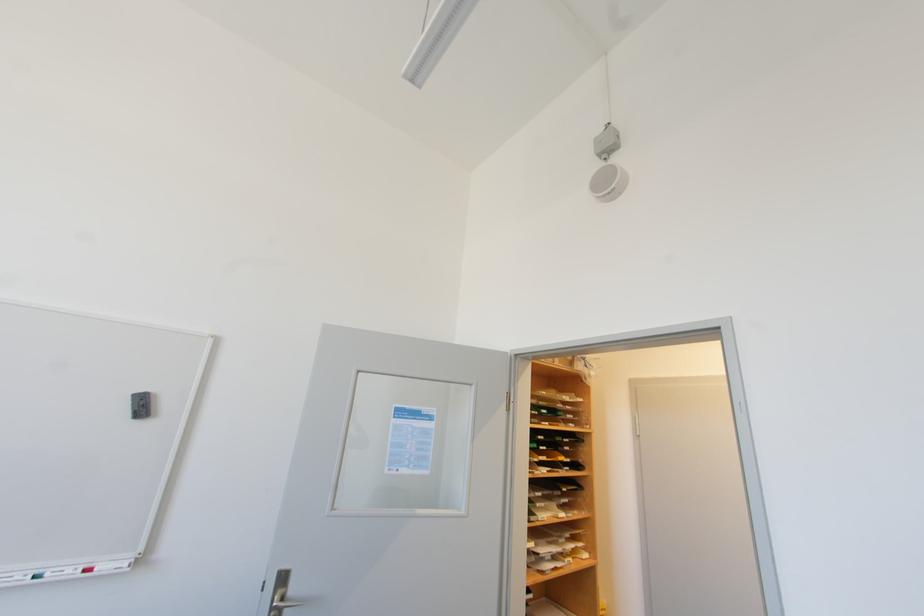
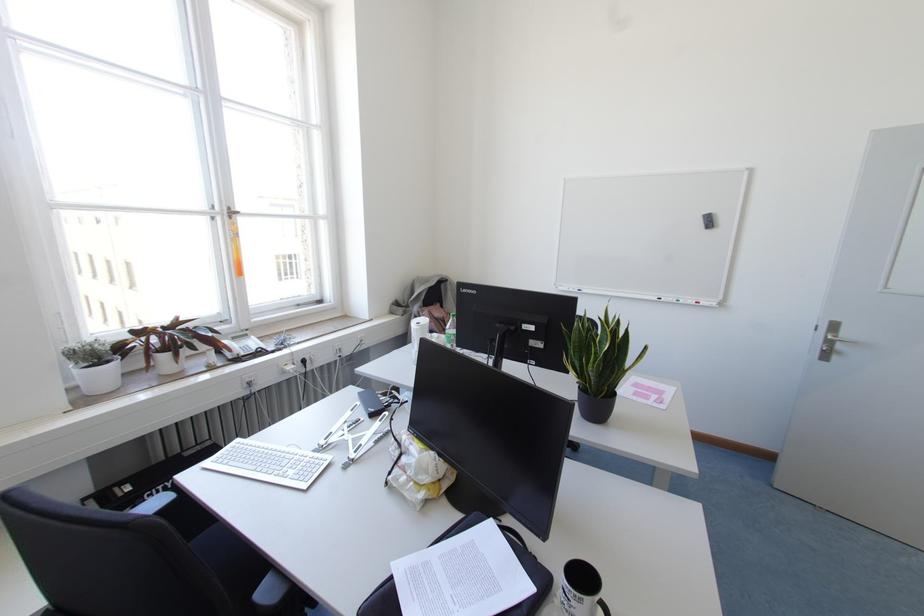
In the second image, find the point that corresponds to point (31, 578) in the first image.

(676, 300)